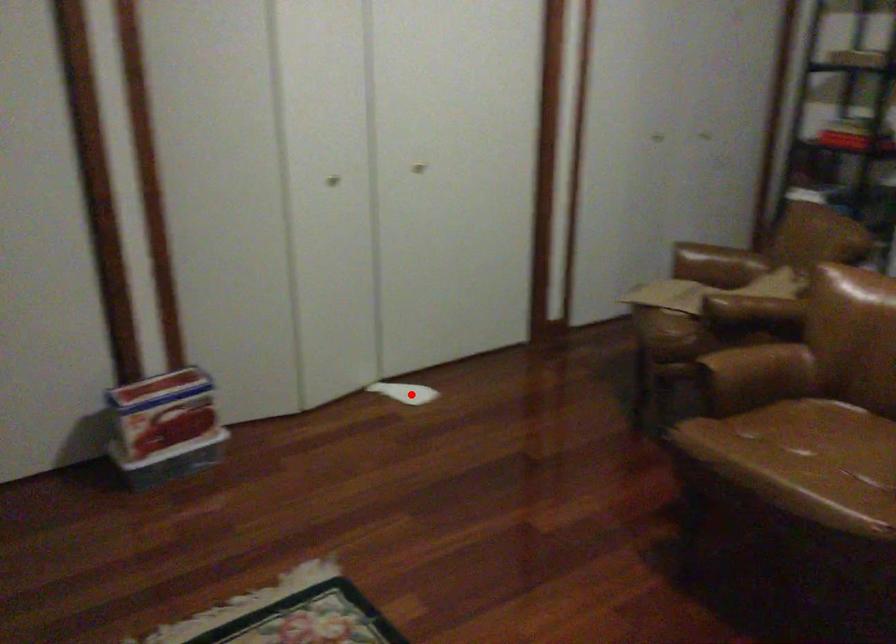
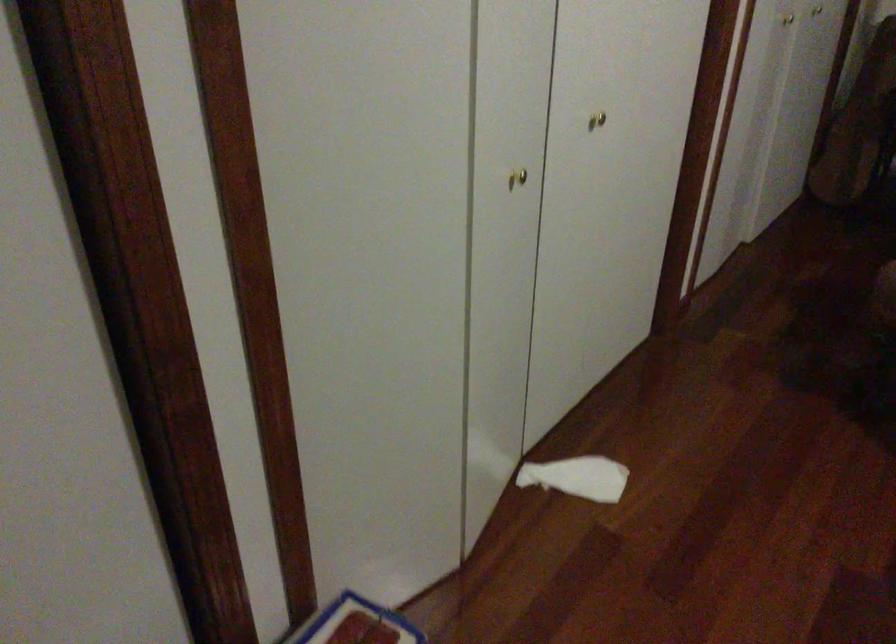
Question: I am providing you with two images of the same scene from different viewpoints. Given a red point in image1, look at the same physical point in image2. Is it:

Choices:
 (A) Closer to the viewpoint
 (B) Farther from the viewpoint

Answer: (A)